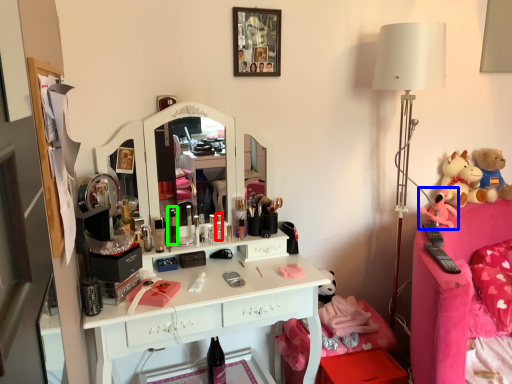
Question: Considering the real-world distances, which object is farthest from toiletry (highlighted by a red box)? toy (highlighted by a blue box) or toiletry (highlighted by a green box)?

Choices:
 (A) toy
 (B) toiletry

Answer: (A)